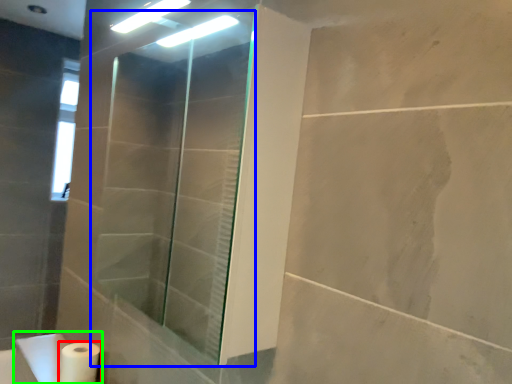
Question: Which object is the farthest from toilet paper (highlighted by a red box)? Choose among these: shower door (highlighted by a blue box) or sink (highlighted by a green box).

Choices:
 (A) shower door
 (B) sink

Answer: (A)